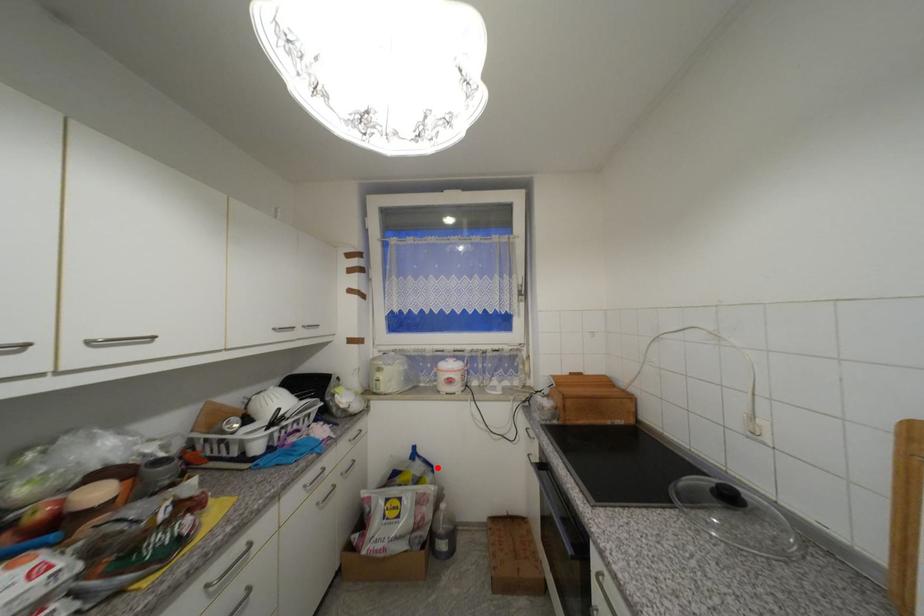
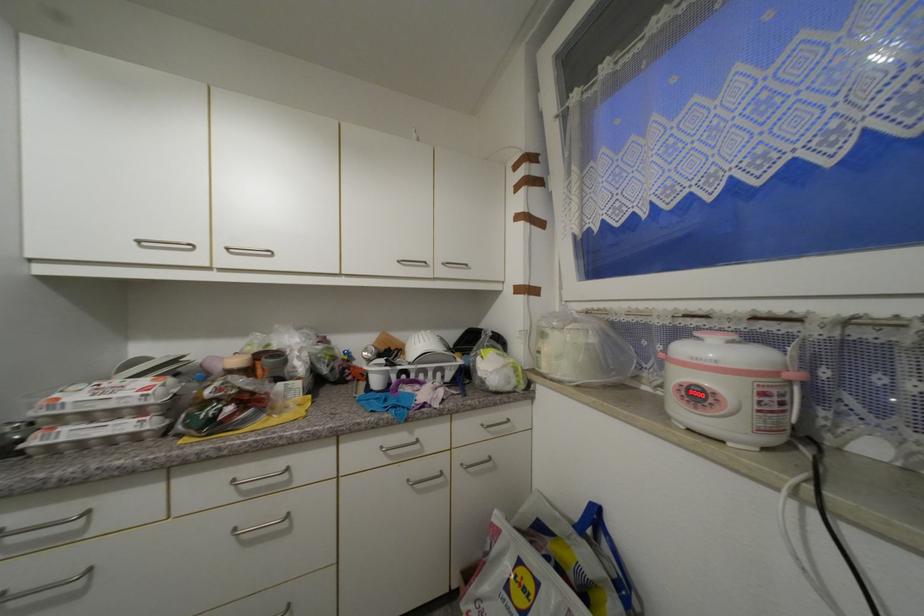
Question: A red point is marked in image1. In image2, is the corresponding 3D point closer to the camera or farther? Reply with the corresponding letter.

Choices:
 (A) The corresponding 3D point is closer.
 (B) The corresponding 3D point is farther.

Answer: (A)